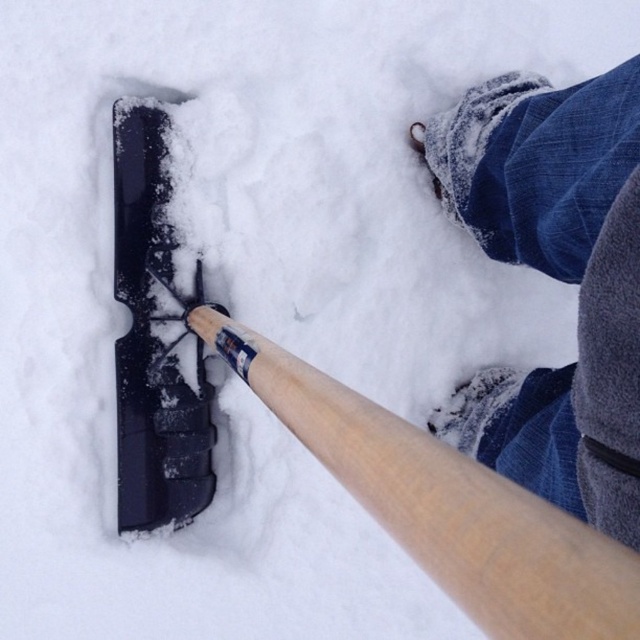
Can you confirm if denim pants at lower right is wider than blue denim jeans at lower right?

Yes.

Looking at this image, which is below, denim pants at lower right or blue denim jeans at lower right?

blue denim jeans at lower right is below.

Identify the location of denim pants at lower right. (556, 278).

Looking at this image, is the position of denim pants at lower right less distant than that of black plastic shovel at lower left?

That is True.

Does denim pants at lower right have a smaller size compared to black plastic shovel at lower left?

No.

Between point (573, 176) and point (120, 506), which one is positioned behind?

Point (120, 506)

What are the coordinates of `denim pants at lower right` in the screenshot? It's located at (556, 278).

Can you confirm if black plastic shovel at lower left is wider than blue denim jeans at lower right?

Indeed, black plastic shovel at lower left has a greater width compared to blue denim jeans at lower right.

What do you see at coordinates (154, 340) in the screenshot?
I see `black plastic shovel at lower left` at bounding box center [154, 340].

What do you see at coordinates (154, 340) in the screenshot? I see `black plastic shovel at lower left` at bounding box center [154, 340].

Locate an element on the screen. Image resolution: width=640 pixels, height=640 pixels. black plastic shovel at lower left is located at coordinates (154, 340).